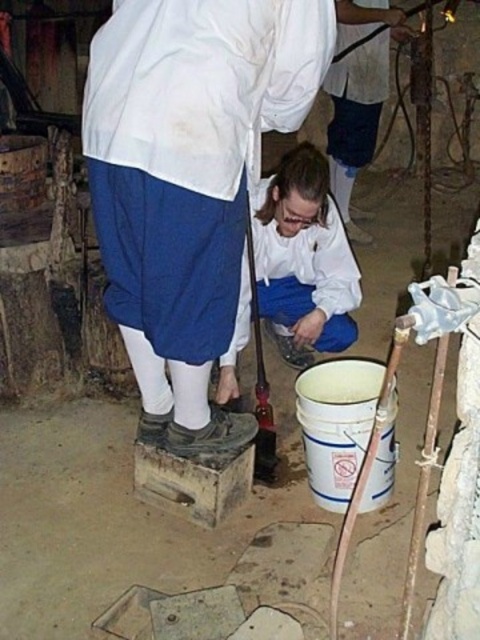
Question: In this image, where is blue cotton skirt at center located relative to white fabric shirt at upper center?

Choices:
 (A) above
 (B) below

Answer: (B)

Question: Is blue cotton skirt at center below white fabric shirt at upper center?

Choices:
 (A) no
 (B) yes

Answer: (B)

Question: Can you confirm if blue cotton skirt at center is thinner than white fabric shirt at upper center?

Choices:
 (A) no
 (B) yes

Answer: (A)

Question: Among these objects, which one is nearest to the camera?

Choices:
 (A) blue cotton skirt at center
 (B) white fabric shirt at upper center

Answer: (A)

Question: Which of the following is the closest to the observer?

Choices:
 (A) blue cotton skirt at center
 (B) white fabric shirt at upper center

Answer: (A)

Question: Which point is closer to the camera taking this photo?

Choices:
 (A) (382, 72)
 (B) (120, 147)

Answer: (B)